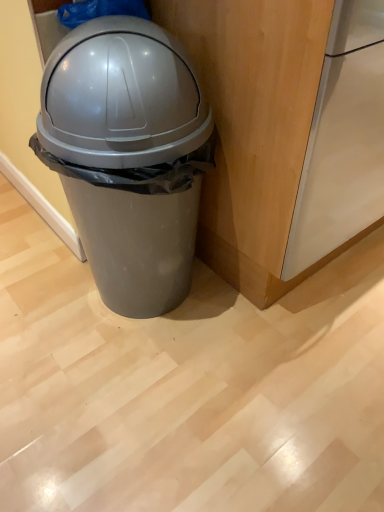
In order to click on free spot to the right of matte gray plastic trash can at center in this screenshot , I will do `click(265, 326)`.